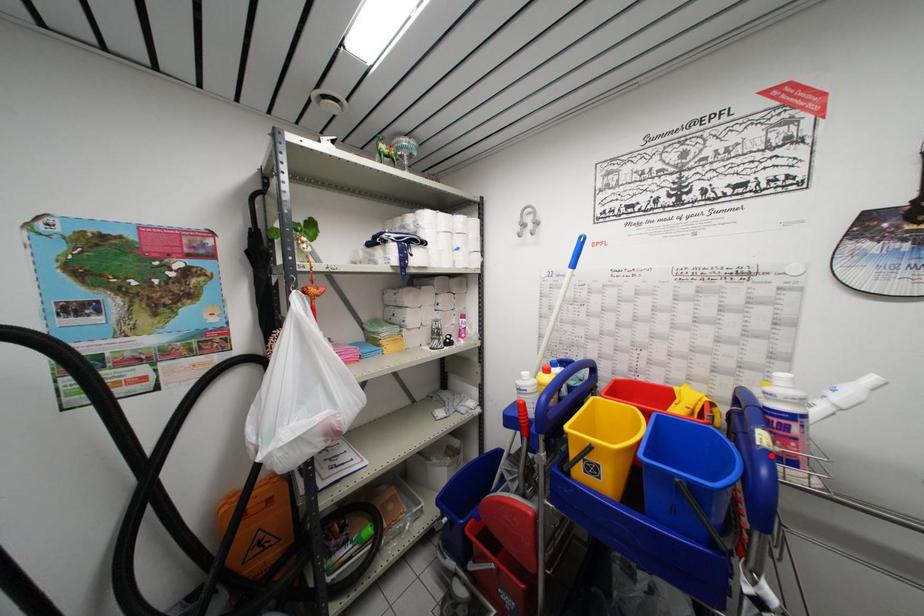
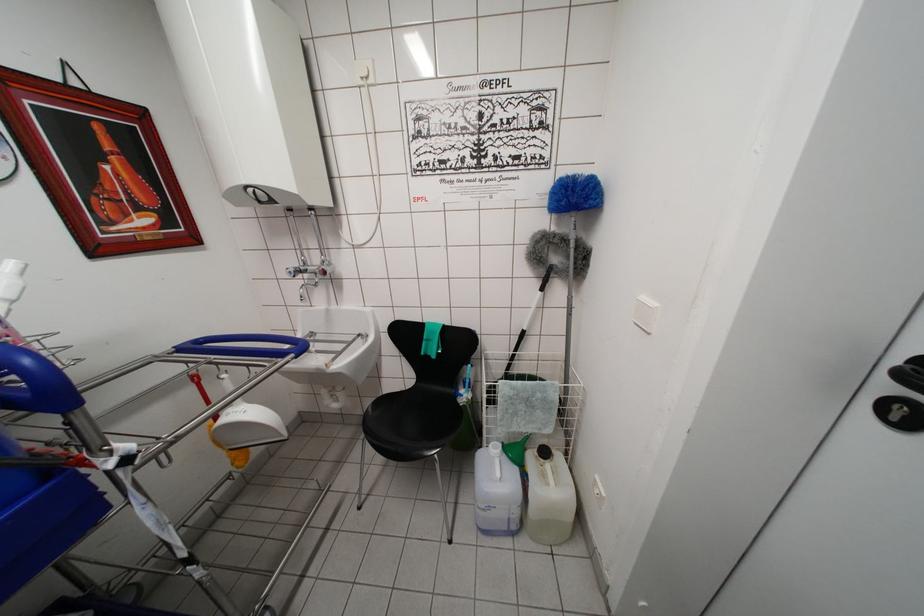
Question: I am providing you with two images of the same scene from different viewpoints. A red point is marked on the first image. Can you still see the location of the red point in image 2?

Choices:
 (A) Yes
 (B) No

Answer: (A)